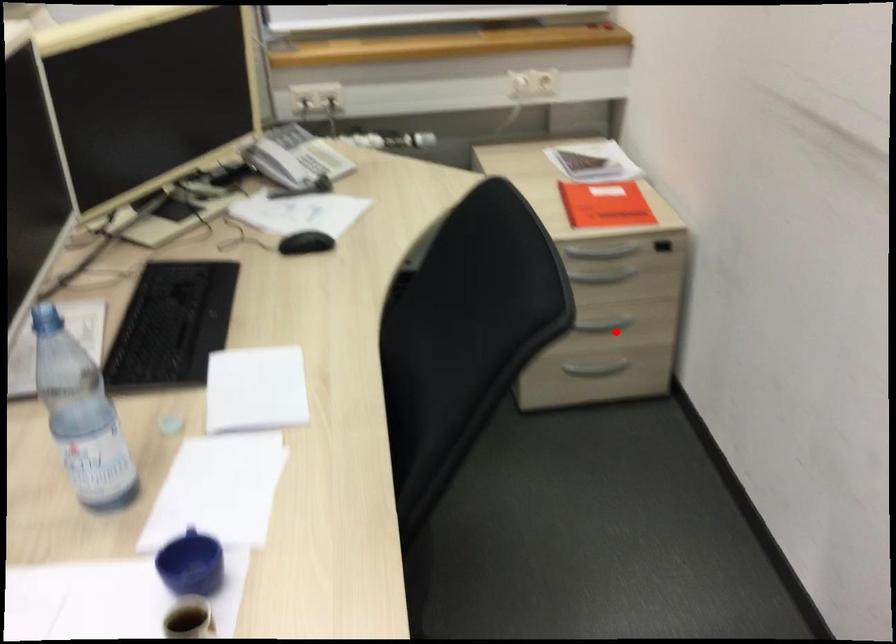
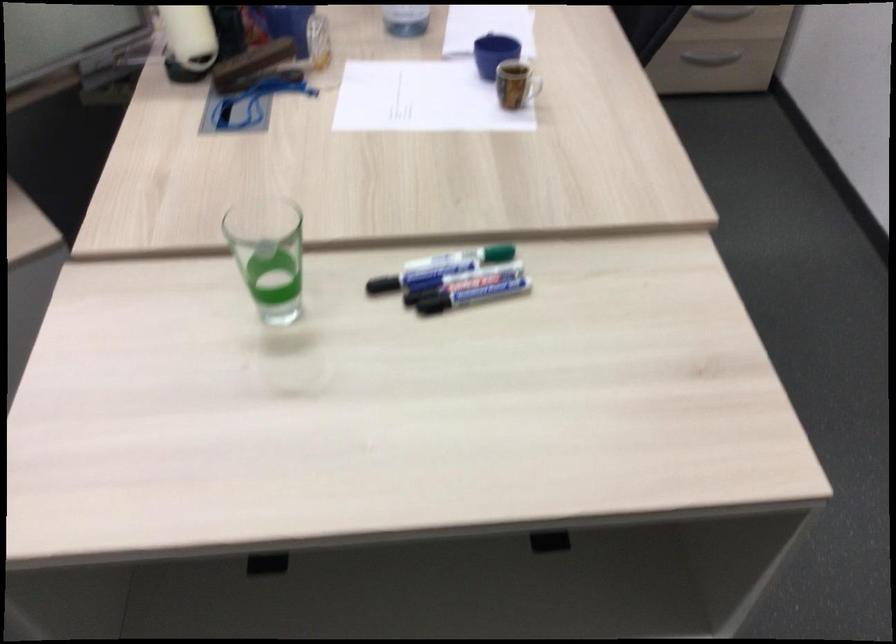
The point at the highlighted location is marked in the first image. Where is the corresponding point in the second image?

(734, 22)